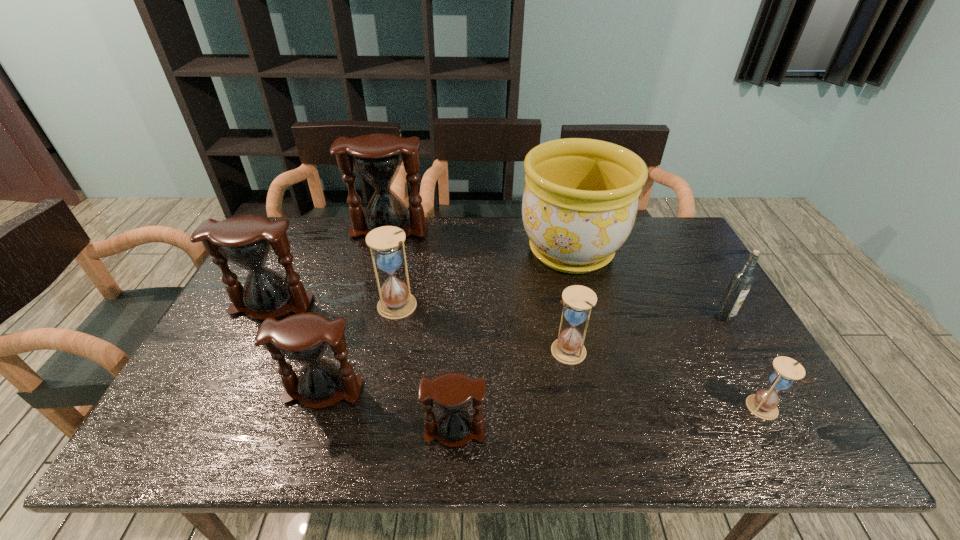
Locate an element on the screen. the biggest brown hourglass is located at coordinates tap(377, 157).

You are a GUI agent. You are given a task and a screenshot of the screen. Output one action in this format:
    pyautogui.click(x=<x>, y=<y>)
    Task: Click on the farthest hourglass
    This screenshot has height=540, width=960.
    Given the screenshot: What is the action you would take?
    pyautogui.click(x=377, y=157)

This screenshot has height=540, width=960. I want to click on flowerpot, so click(580, 201).

Locate an element on the screen. The height and width of the screenshot is (540, 960). the biggest white hourglass is located at coordinates (396, 302).

Locate an element on the screen. the farthest white hourglass is located at coordinates (396, 302).

At what (x,y) coordinates should I click in order to perform the action: click on the second farthest brown hourglass. Please return your answer as a coordinate pair (x, y). The image size is (960, 540). Looking at the image, I should click on (246, 241).

Identify the location of the leftmost brown hourglass. This screenshot has width=960, height=540. (246, 241).

The width and height of the screenshot is (960, 540). What are the coordinates of `vodka` in the screenshot? It's located at point(742,280).

Where is `the second white hourglass from right to left`? the second white hourglass from right to left is located at coordinates (578, 300).

This screenshot has width=960, height=540. In order to click on the fourth nearest object in this screenshot , I will do [578, 300].